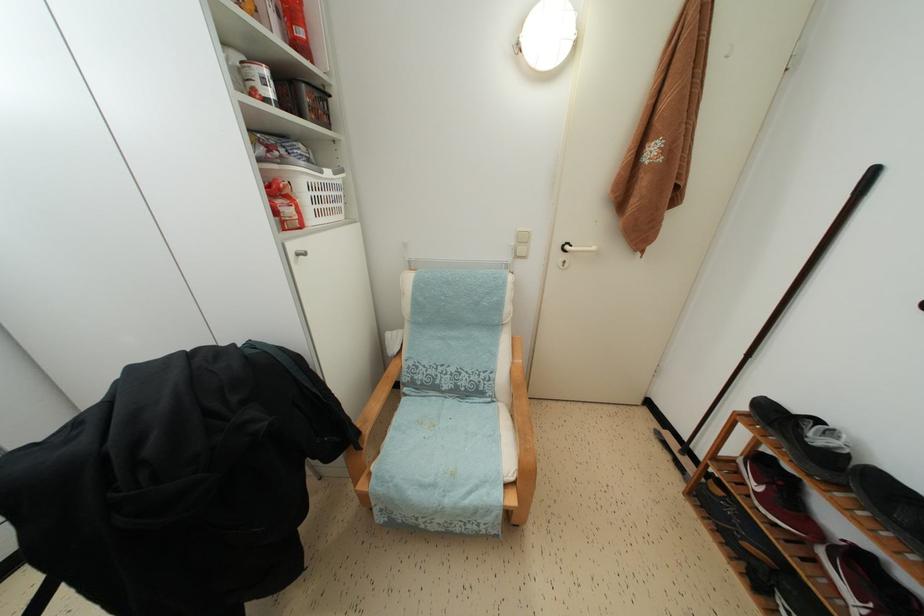
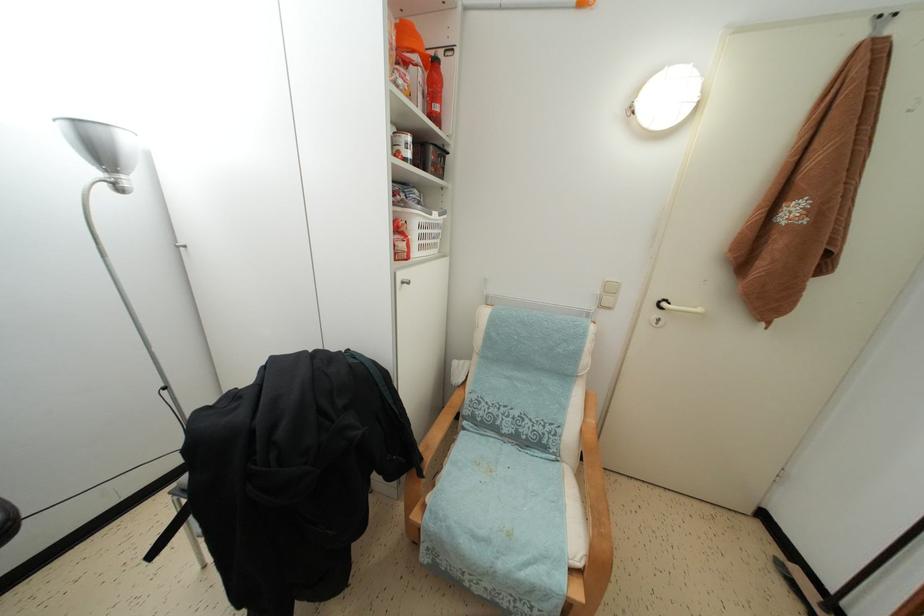
Question: What movement of the cameraman would produce the second image?

Choices:
 (A) Left
 (B) Right
 (C) Forward
 (D) Backward

Answer: (A)